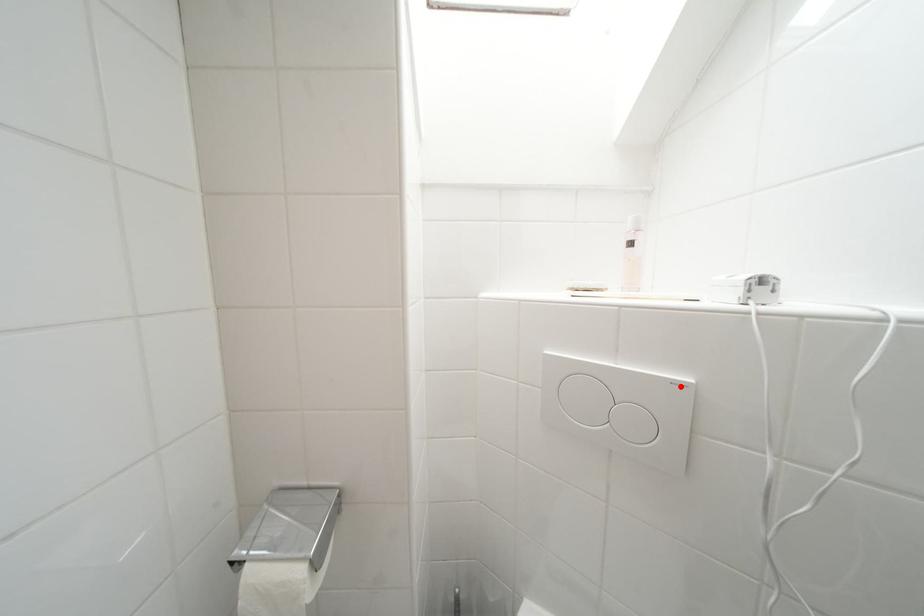
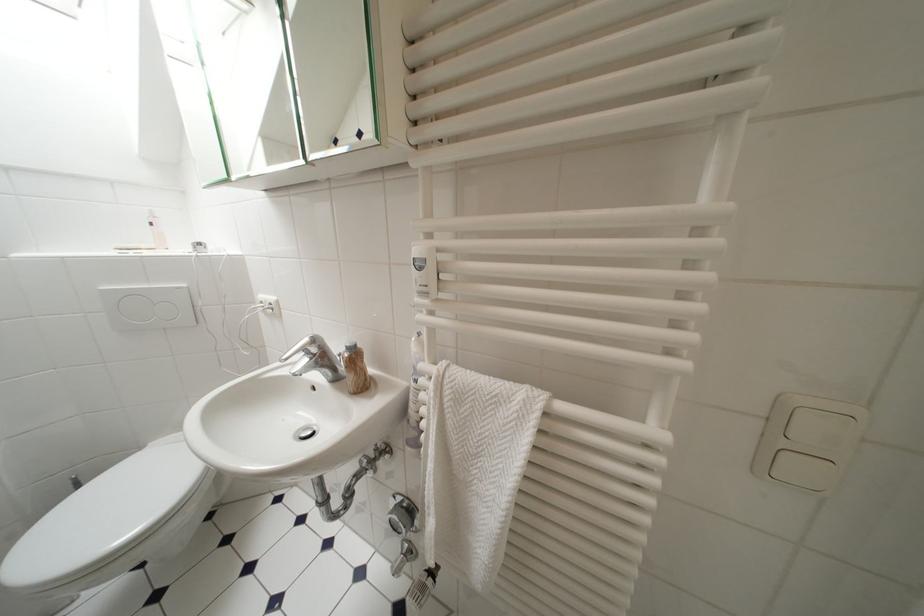
Where in the second image is the point corresponding to the highlighted location from the first image?

(185, 291)